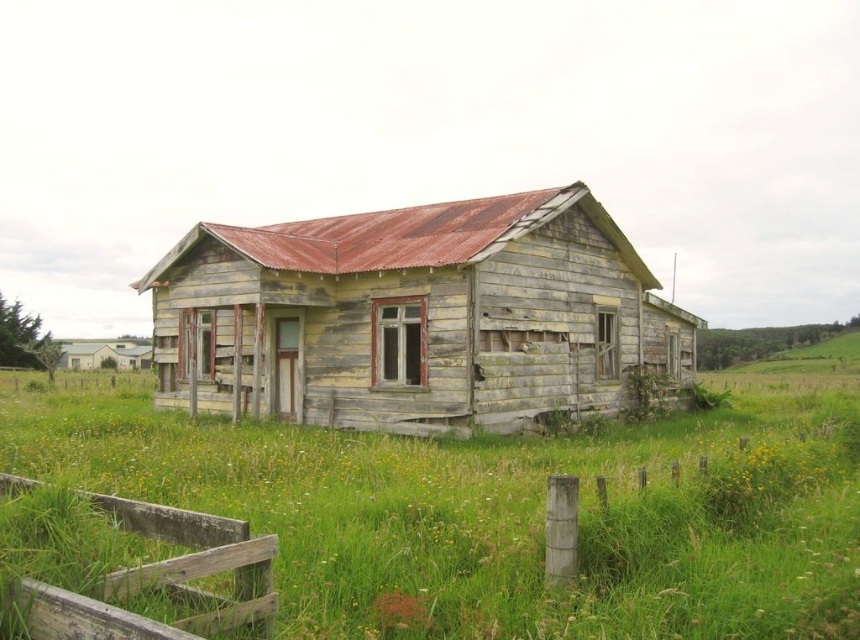
You are standing at the lower left corner of the image where the weathered wood fence at lower left is located. You want to walk towards the weathered wood hut at center. In which direction should you move relative to the fence?

You should move upward relative to the weathered wood fence at lower left because the weathered wood hut at center is located above it.

You are a maintenance worker holding a 3.0 meter long ladder. You need to move from the green grass at center to the weathered wood hut at center. Can you carry the ladder horizontally without tilting it while moving between them?

The distance between green grass at center and weathered wood hut at center is 3.19 meters. Since the ladder is 3.0 meters long, it can be carried horizontally as the space between them is sufficient to accommodate the ladder without tilting.

You are a painter standing at the lower left corner of the image. You need to paint both the weathered wood hut at center and the weathered wood fence at lower left. Which object should you paint first if you want to start with the taller one?

The weathered wood hut at center should be painted first because it has a greater height compared to the weathered wood fence at lower left.